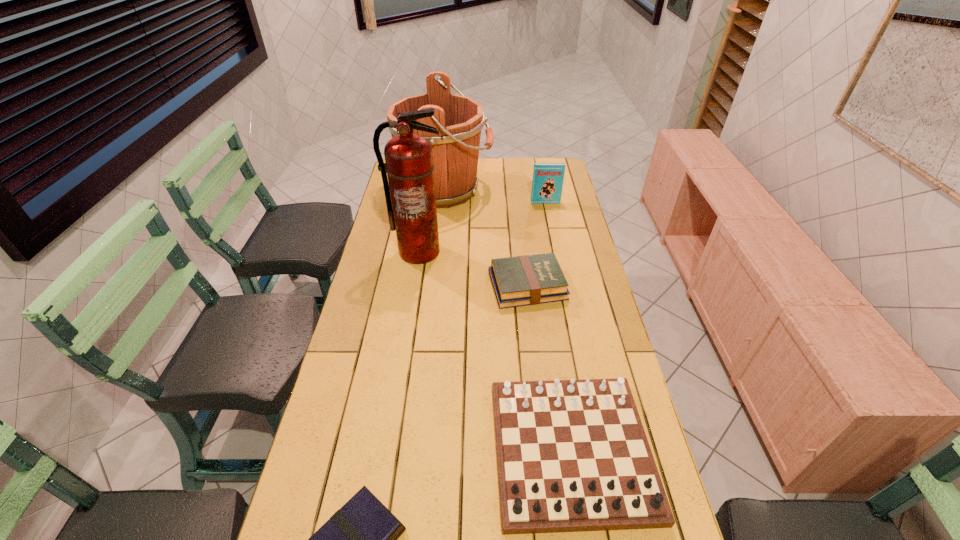
Image resolution: width=960 pixels, height=540 pixels. What are the coordinates of `vacant space that satisfies the following two spatial constraints: 1. with the handle on the side of the second tallest object; 2. on the left side of the fourth tallest object` in the screenshot? It's located at (416, 450).

Find the location of a particular element. Image resolution: width=960 pixels, height=540 pixels. blank space that satisfies the following two spatial constraints: 1. with the handle on the side of the second tallest object; 2. on the back side of the fourth tallest object is located at coordinates (416, 450).